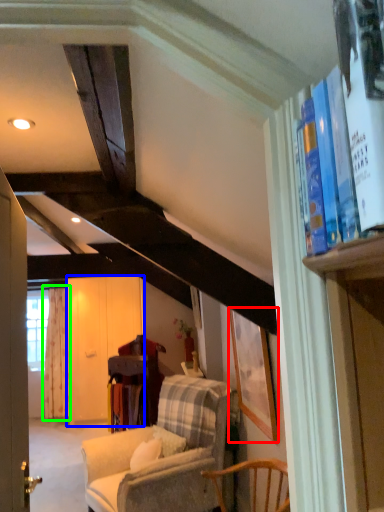
Question: Considering the real-world distances, which object is farthest from picture frame (highlighted by a red box)? screen door (highlighted by a blue box) or curtain (highlighted by a green box)?

Choices:
 (A) screen door
 (B) curtain

Answer: (B)